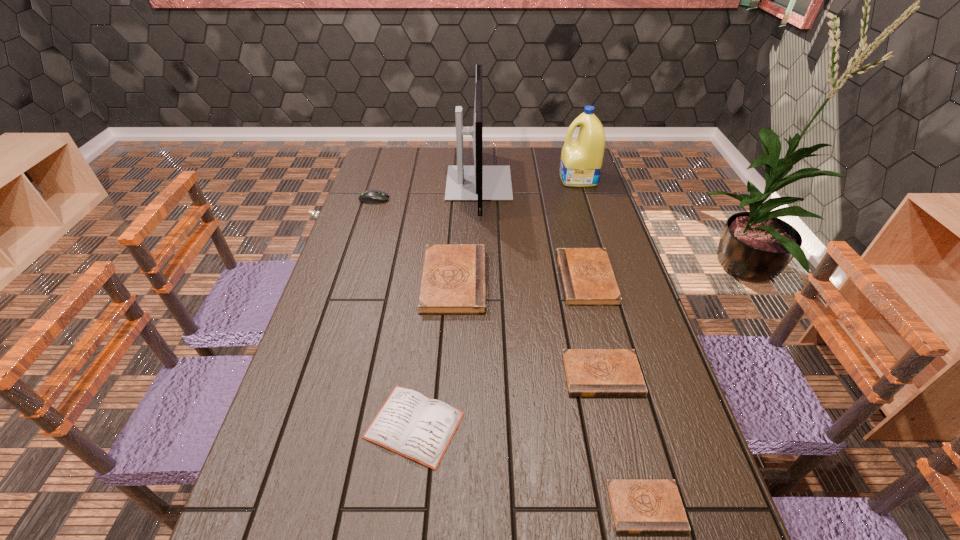
Where is `white diary`? This screenshot has width=960, height=540. white diary is located at coordinates (412, 425).

The image size is (960, 540). Identify the location of the nearest diary. (638, 506).

Locate an element on the screen. Image resolution: width=960 pixels, height=540 pixels. the smallest brown diary is located at coordinates (638, 506).

Find the location of `free region located 0.140m on the screen of the tallest object`. free region located 0.140m on the screen of the tallest object is located at coordinates (547, 183).

Find the location of `free region located on the label of the detergent`. free region located on the label of the detergent is located at coordinates (516, 179).

Identify the location of vacant space located on the label of the detergent. (468, 179).

Image resolution: width=960 pixels, height=540 pixels. Find the location of `vacant space situated on the label of the detergent`. vacant space situated on the label of the detergent is located at coordinates (487, 179).

What are the coordinates of `vacant region located 0.050m on the wheel side of the gray computer mouse` in the screenshot? It's located at (403, 199).

Find the location of a particular element. The image size is (960, 540). vacant area situated on the spine side of the biggest brown diary is located at coordinates (576, 281).

Identify the location of free space located on the spine side of the third smallest brown diary. (477, 279).